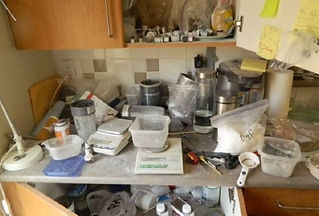
This screenshot has height=216, width=319. Find the location of `tupperwear`. tupperwear is located at coordinates (150, 131), (62, 143), (281, 155), (315, 162).